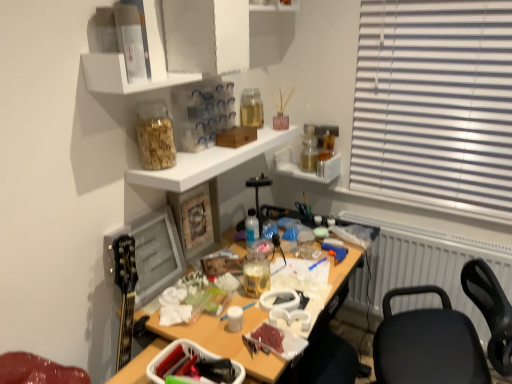
Question: From the image's perspective, relative to clear plastic container at upper center, arranged as the first shelf when viewed from the top, is translucent glass jar at upper right, positioned as the 1th bottle in back-to-front order, above or below?

Choices:
 (A) below
 (B) above

Answer: (A)

Question: Visually, is translucent glass jar at upper right, the 4th bottle from the left, positioned to the left or to the right of clear plastic container at upper center, the 4th shelf from the bottom?

Choices:
 (A) left
 (B) right

Answer: (B)

Question: Which object is the farthest from the white glossy shelf at upper center, the 3th shelf when ordered from top to bottom?

Choices:
 (A) translucent glass jar at upper center, the 2th bottle from the bottom
 (B) translucent glass bottle at upper center, which ranks as the 1th bottle in top-to-bottom order
 (C) clear plastic container at upper center, arranged as the first shelf when viewed from the top
 (D) translucent glass jar at upper right, the 4th bottle when ordered from front to back
 (E) white plastic radiator at right

Answer: (E)

Question: Which of these objects is positioned farthest from the translucent glass jars at upper right, which is counted as the 1th shelf, starting from the bottom?

Choices:
 (A) translucent glass jar at upper right, the 4th bottle from the left
 (B) clear plastic container at upper center, arranged as the first shelf when viewed from the top
 (C) translucent glass bottle at upper center, which ranks as the 1th bottle in top-to-bottom order
 (D) white glossy shelf at upper center, the 3th shelf when ordered from top to bottom
 (E) white glossy shelf at upper center, acting as the 2th shelf starting from the top

Answer: (E)